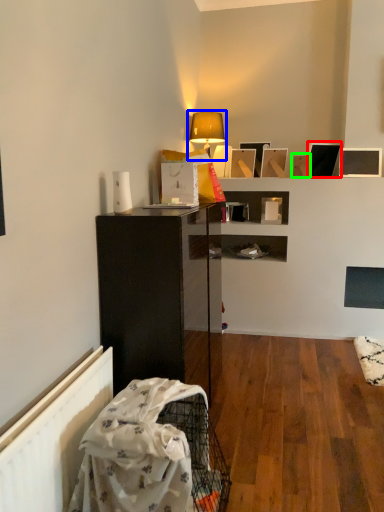
Question: Which object is positioned farthest from picture frame (highlighted by a red box)? Select from lamp (highlighted by a blue box) and picture frame (highlighted by a green box).

Choices:
 (A) lamp
 (B) picture frame

Answer: (A)